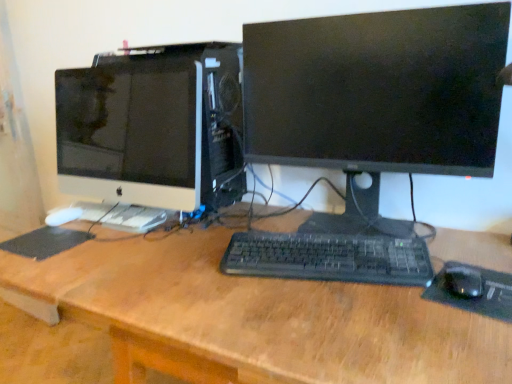
The width and height of the screenshot is (512, 384). In order to click on free space to the right of black matte mousepad at lower left, which is the 2th mousepad in right-to-left order in this screenshot , I will do `click(109, 242)`.